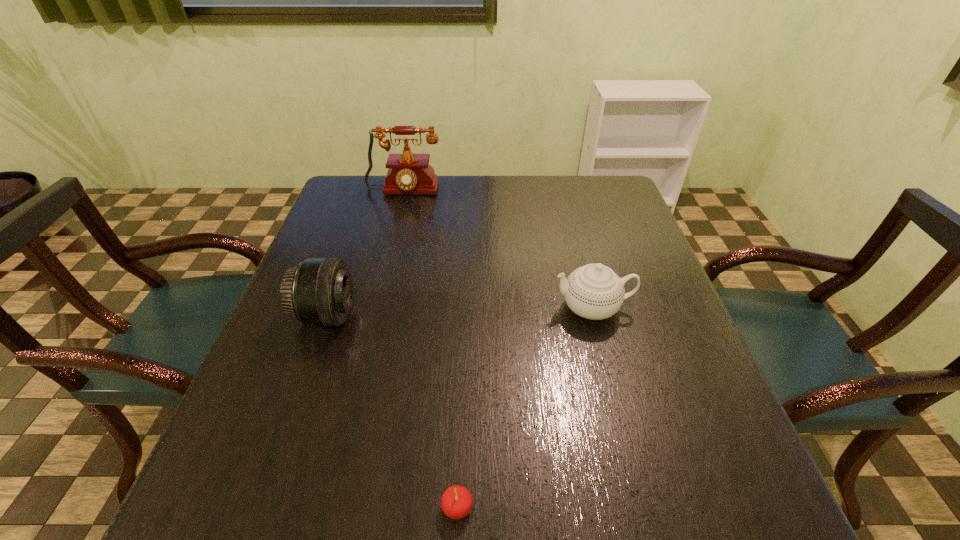
Find the location of a particular element. The image size is (960, 540). free space located 0.320m on the spout of the chinaware is located at coordinates (409, 308).

Where is `vacant space situated 0.160m on the back of the nearest object`? This screenshot has height=540, width=960. vacant space situated 0.160m on the back of the nearest object is located at coordinates (461, 402).

Identify the location of object that is positioned at the far edge. (408, 173).

At what (x,y) coordinates should I click in order to perform the action: click on object that is at the near edge. Please return your answer as a coordinate pair (x, y). The width and height of the screenshot is (960, 540). Looking at the image, I should click on (456, 502).

I want to click on telephone located at the left edge, so click(408, 173).

Image resolution: width=960 pixels, height=540 pixels. I want to click on telephoto lens present at the left edge, so click(x=319, y=291).

Identify the location of object located in the right edge section of the desktop. Image resolution: width=960 pixels, height=540 pixels. (594, 291).

The width and height of the screenshot is (960, 540). In order to click on object at the far left corner in this screenshot , I will do `click(408, 173)`.

In the image, there is a desktop. Identify the location of blank space at the far edge. (499, 184).

Locate an element on the screen. free space at the near edge of the desktop is located at coordinates (592, 521).